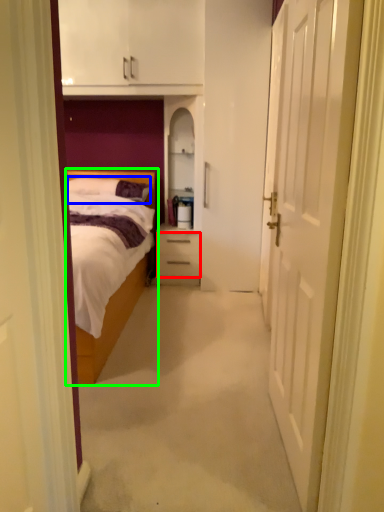
Question: Which object is positioned farthest from drawer (highlighted by a red box)? Select from pillow (highlighted by a blue box) and bed (highlighted by a green box).

Choices:
 (A) pillow
 (B) bed

Answer: (B)